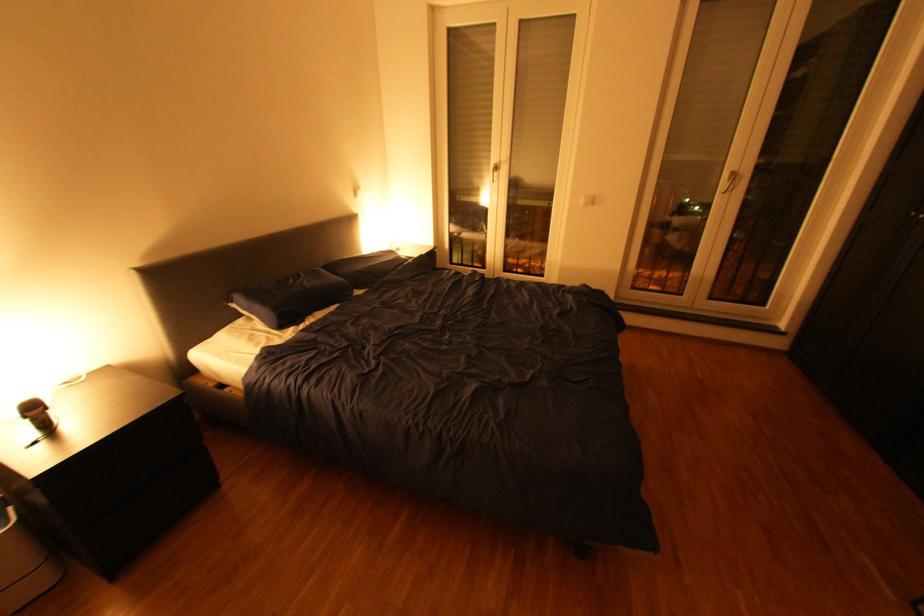
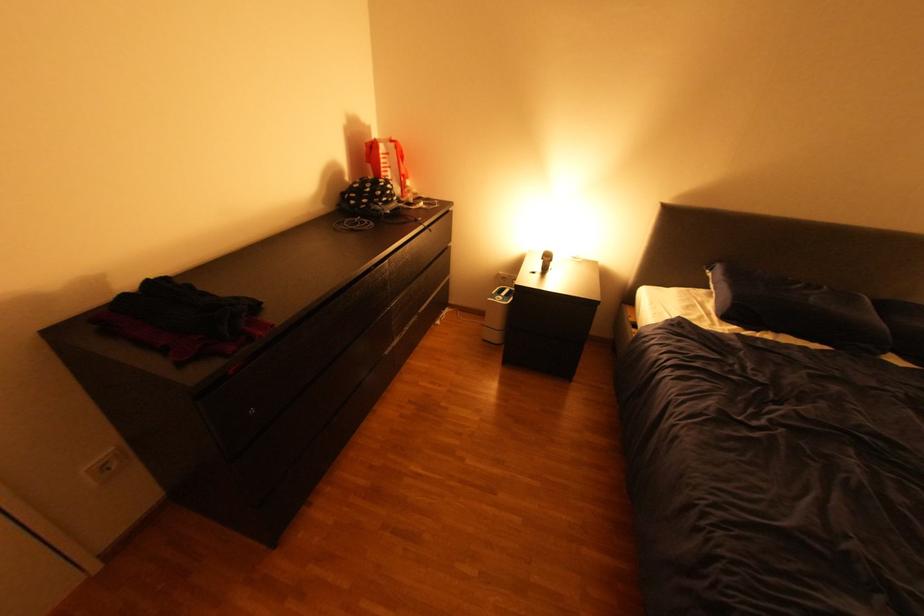
The images are taken continuously from a first-person perspective. In which direction is your viewpoint rotating?

The camera's rotation is toward left-down.